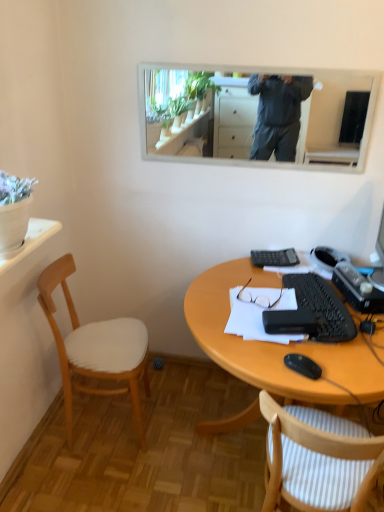
At what (x,y) coordinates should I click in order to perform the action: click on vacant space situated above white paper at center (from a real-world perspective). Please return your answer as a coordinate pair (x, y). Image resolution: width=384 pixels, height=512 pixels. Looking at the image, I should click on (270, 301).